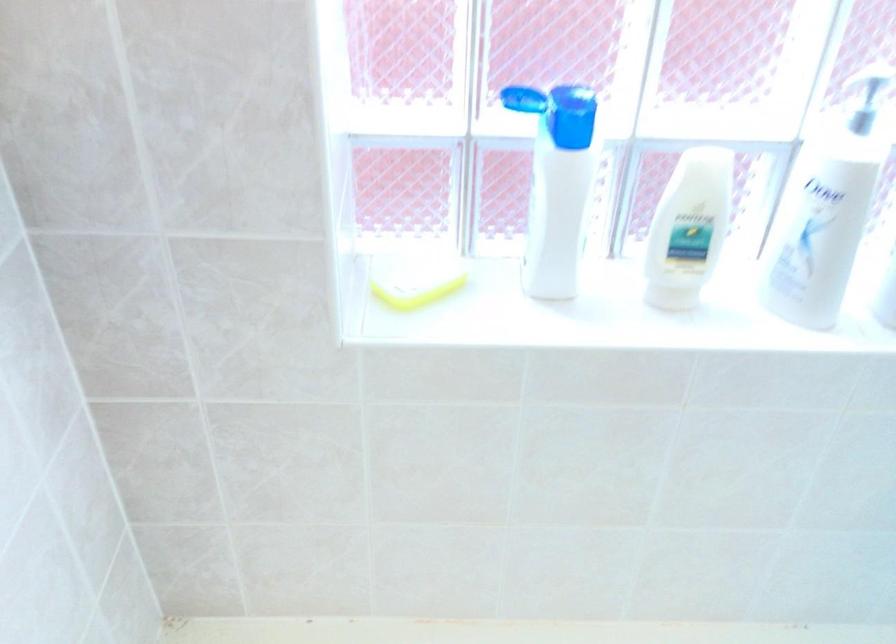
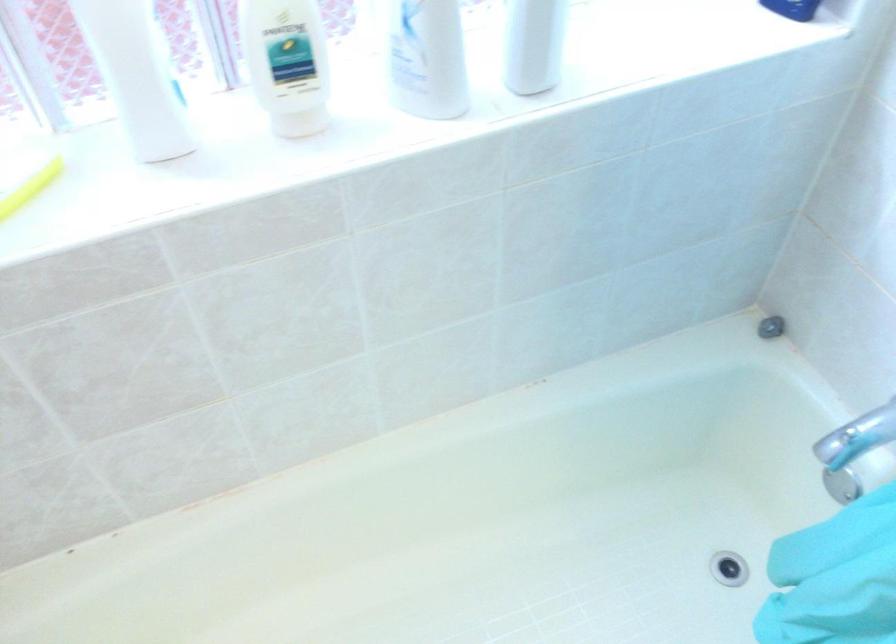
Question: Based on the continuous images, in which direction is the camera rotating? Reply with the corresponding letter.

Choices:
 (A) Left
 (B) Right
 (C) Up
 (D) Down

Answer: (D)